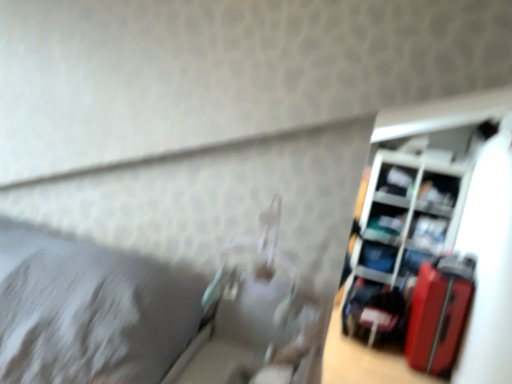
The width and height of the screenshot is (512, 384). Describe the element at coordinates (376, 261) in the screenshot. I see `matte black laptop at right, the 5th shelf in the top-to-bottom sequence` at that location.

Find the location of a particular element. Image resolution: width=512 pixels, height=384 pixels. shiny red suitcase at right is located at coordinates (439, 313).

What do you see at coordinates (438, 194) in the screenshot? I see `matte black shelf at upper right, the fourth shelf when ordered from bottom to top` at bounding box center [438, 194].

This screenshot has width=512, height=384. In order to click on matte plastic shelf at right, the second shelf from the bottom in this screenshot , I will do `click(406, 225)`.

Does point (371, 272) come closer to viewer compared to point (398, 205)?

That is False.

Does matte black laptop at right, the 5th shelf in the top-to-bottom sequence, have a greater width compared to matte plastic shelf at right, arranged as the fourth shelf when viewed from the top?

Incorrect, the width of matte black laptop at right, the 5th shelf in the top-to-bottom sequence, does not surpass that of matte plastic shelf at right, arranged as the fourth shelf when viewed from the top.

Considering the relative positions of matte black laptop at right, the 5th shelf in the top-to-bottom sequence, and matte plastic shelf at right, the second shelf from the bottom, in the image provided, is matte black laptop at right, the 5th shelf in the top-to-bottom sequence, to the right of matte plastic shelf at right, the second shelf from the bottom, from the viewer's perspective?

In fact, matte black laptop at right, the 5th shelf in the top-to-bottom sequence, is to the left of matte plastic shelf at right, the second shelf from the bottom.

From the image's perspective, between matte plastic shelf at right, the second shelf from the bottom, and black plastic shelf at upper right, the 5th shelf ordered from the bottom, which one is located above?

black plastic shelf at upper right, the 5th shelf ordered from the bottom.

How many degrees apart are the facing directions of matte plastic shelf at right, the second shelf from the bottom, and black plastic shelf at upper right, which ranks as the 1th shelf in top-to-bottom order?

5.65 degrees separate the facing orientations of matte plastic shelf at right, the second shelf from the bottom, and black plastic shelf at upper right, which ranks as the 1th shelf in top-to-bottom order.

Does matte plastic shelf at right, the second shelf from the bottom, have a greater height compared to black plastic shelf at upper right, which ranks as the 1th shelf in top-to-bottom order?

Indeed, matte plastic shelf at right, the second shelf from the bottom, has a greater height compared to black plastic shelf at upper right, which ranks as the 1th shelf in top-to-bottom order.

Does matte plastic shelf at right, arranged as the fourth shelf when viewed from the top, come behind black plastic shelf at upper right, which ranks as the 1th shelf in top-to-bottom order?

No, the depth of matte plastic shelf at right, arranged as the fourth shelf when viewed from the top, is less than that of black plastic shelf at upper right, which ranks as the 1th shelf in top-to-bottom order.

From the image's perspective, which object appears higher, black plastic shelf at upper right, the 5th shelf ordered from the bottom, or matte black shelf at upper right, the fourth shelf when ordered from bottom to top?

black plastic shelf at upper right, the 5th shelf ordered from the bottom, appears higher in the image.

Who is taller, black plastic shelf at upper right, the 5th shelf ordered from the bottom, or matte black shelf at upper right, the fourth shelf when ordered from bottom to top?

With more height is matte black shelf at upper right, the fourth shelf when ordered from bottom to top.

At what (x,y) coordinates should I click in order to perform the action: click on the 2nd shelf behind when counting from the matte black shelf at upper right, the second shelf in the top-to-bottom sequence. Please return your answer as a coordinate pair (x, y). Looking at the image, I should click on (396, 186).

Is black plastic shelf at upper right, which ranks as the 1th shelf in top-to-bottom order, not near matte black shelf at upper right, the second shelf in the top-to-bottom sequence?

That's not correct — black plastic shelf at upper right, which ranks as the 1th shelf in top-to-bottom order, is a little close to matte black shelf at upper right, the second shelf in the top-to-bottom sequence.

From the image's perspective, which one is positioned lower, shiny red suitcase at right or matte plastic shelf at right, arranged as the fourth shelf when viewed from the top?

shiny red suitcase at right, from the image's perspective.

The image size is (512, 384). Find the location of `luggage on the left of the matte plastic shelf at right, the second shelf from the bottom`. luggage on the left of the matte plastic shelf at right, the second shelf from the bottom is located at coordinates (439, 313).

Between shiny red suitcase at right and matte plastic shelf at right, arranged as the fourth shelf when viewed from the top, which one has more height?

With more height is matte plastic shelf at right, arranged as the fourth shelf when viewed from the top.

Is shiny red suitcase at right to the right of matte plastic shelf at right, the second shelf from the bottom, from the viewer's perspective?

No, shiny red suitcase at right is not to the right of matte plastic shelf at right, the second shelf from the bottom.

From the picture: Is matte black shelf at upper right, the second shelf in the top-to-bottom sequence, located outside matte plastic shelf at upper right, placed as the 3th shelf when sorted from top to bottom?

Absolutely, matte black shelf at upper right, the second shelf in the top-to-bottom sequence, is external to matte plastic shelf at upper right, placed as the 3th shelf when sorted from top to bottom.

Is point (434, 180) closer or farther from the camera than point (441, 237)?

Clearly, point (434, 180) is more distant from the camera than point (441, 237).

From the image's perspective, is matte black shelf at upper right, the fourth shelf when ordered from bottom to top, located beneath matte plastic shelf at upper right, placed as the 3th shelf when sorted from top to bottom?

No, from the image's perspective, matte black shelf at upper right, the fourth shelf when ordered from bottom to top, is not beneath matte plastic shelf at upper right, placed as the 3th shelf when sorted from top to bottom.

What's the angular difference between shiny red suitcase at right and matte black shelf at upper right, the second shelf in the top-to-bottom sequence,'s facing directions?

The facing directions of shiny red suitcase at right and matte black shelf at upper right, the second shelf in the top-to-bottom sequence, are 82.2 degrees apart.

Is shiny red suitcase at right not near matte black shelf at upper right, the fourth shelf when ordered from bottom to top?

Yes, shiny red suitcase at right and matte black shelf at upper right, the fourth shelf when ordered from bottom to top, are located far from each other.

Which is closer to the camera, [467,261] or [426,180]?

Point [467,261] appears to be closer to the viewer than point [426,180].

Does shiny red suitcase at right have a greater width compared to matte black shelf at upper right, the second shelf in the top-to-bottom sequence?

Indeed, shiny red suitcase at right has a greater width compared to matte black shelf at upper right, the second shelf in the top-to-bottom sequence.

From the image's perspective, is matte plastic shelf at right, arranged as the fourth shelf when viewed from the top, positioned above or below matte black shelf at upper right, the second shelf in the top-to-bottom sequence?

matte plastic shelf at right, arranged as the fourth shelf when viewed from the top, is situated lower than matte black shelf at upper right, the second shelf in the top-to-bottom sequence, in the image.

Which object is wider, matte plastic shelf at right, the second shelf from the bottom, or matte black shelf at upper right, the second shelf in the top-to-bottom sequence?

matte plastic shelf at right, the second shelf from the bottom.

Is matte plastic shelf at right, arranged as the fourth shelf when viewed from the top, turned away from matte black shelf at upper right, the second shelf in the top-to-bottom sequence?

Yes, matte plastic shelf at right, arranged as the fourth shelf when viewed from the top, is positioned with its back facing matte black shelf at upper right, the second shelf in the top-to-bottom sequence.

Does matte plastic shelf at right, arranged as the fourth shelf when viewed from the top, appear on the right side of matte black shelf at upper right, the second shelf in the top-to-bottom sequence?

Incorrect, matte plastic shelf at right, arranged as the fourth shelf when viewed from the top, is not on the right side of matte black shelf at upper right, the second shelf in the top-to-bottom sequence.

At what (x,y) coordinates should I click in order to perform the action: click on shelf that is the 4th object located in front of the matte black laptop at right, which is the 1th shelf in bottom-to-top order. Please return your answer as a coordinate pair (x, y). The height and width of the screenshot is (384, 512). Looking at the image, I should click on (406, 225).

From the image's perspective, starting from the black plastic shelf at upper right, which ranks as the 1th shelf in top-to-bottom order, which shelf is the 3rd one below? Please provide its 2D coordinates.

[(406, 225)]

Based on their spatial positions, is matte black shelf at upper right, the second shelf in the top-to-bottom sequence, or shiny red suitcase at right closer to black plastic shelf at upper right, the 5th shelf ordered from the bottom?

matte black shelf at upper right, the second shelf in the top-to-bottom sequence, lies closer to black plastic shelf at upper right, the 5th shelf ordered from the bottom, than the other object.

Considering their positions, is black plastic shelf at upper right, the 5th shelf ordered from the bottom, positioned further to shiny red suitcase at right than matte plastic shelf at right, arranged as the fourth shelf when viewed from the top?

Based on the image, black plastic shelf at upper right, the 5th shelf ordered from the bottom, appears to be further to shiny red suitcase at right.

When comparing their distances from matte plastic shelf at upper right, placed as the 3th shelf when sorted from top to bottom, does matte black shelf at upper right, the second shelf in the top-to-bottom sequence, or black plastic shelf at upper right, which ranks as the 1th shelf in top-to-bottom order, seem further?

Among the two, black plastic shelf at upper right, which ranks as the 1th shelf in top-to-bottom order, is located further to matte plastic shelf at upper right, placed as the 3th shelf when sorted from top to bottom.

From the image, which object appears to be nearer to matte black shelf at upper right, the second shelf in the top-to-bottom sequence, shiny red suitcase at right or matte plastic shelf at right, the second shelf from the bottom?

matte plastic shelf at right, the second shelf from the bottom, is positioned closer to the anchor matte black shelf at upper right, the second shelf in the top-to-bottom sequence.

Which object lies nearer to the anchor point matte plastic shelf at upper right, the third shelf from the bottom, matte black shelf at upper right, the second shelf in the top-to-bottom sequence, or matte black laptop at right, which is the 1th shelf in bottom-to-top order?

matte black shelf at upper right, the second shelf in the top-to-bottom sequence, is closer to matte plastic shelf at upper right, the third shelf from the bottom.

Considering their positions, is shiny red suitcase at right positioned further to matte black shelf at upper right, the fourth shelf when ordered from bottom to top, than matte plastic shelf at upper right, placed as the 3th shelf when sorted from top to bottom?

shiny red suitcase at right.

From the image, which object appears to be nearer to matte black shelf at upper right, the fourth shelf when ordered from bottom to top, matte plastic shelf at right, arranged as the fourth shelf when viewed from the top, or matte plastic shelf at upper right, the third shelf from the bottom?

The object closer to matte black shelf at upper right, the fourth shelf when ordered from bottom to top, is matte plastic shelf at upper right, the third shelf from the bottom.

From the image, which object appears to be nearer to matte black shelf at upper right, the fourth shelf when ordered from bottom to top, matte black laptop at right, the 5th shelf in the top-to-bottom sequence, or matte plastic shelf at upper right, the third shelf from the bottom?

matte plastic shelf at upper right, the third shelf from the bottom, lies closer to matte black shelf at upper right, the fourth shelf when ordered from bottom to top, than the other object.

The image size is (512, 384). Find the location of `shelf between matte black shelf at upper right, the second shelf in the top-to-bottom sequence, and matte plastic shelf at right, the second shelf from the bottom, from top to bottom`. shelf between matte black shelf at upper right, the second shelf in the top-to-bottom sequence, and matte plastic shelf at right, the second shelf from the bottom, from top to bottom is located at coordinates (429, 233).

Where is `shelf between black plastic shelf at upper right, which ranks as the 1th shelf in top-to-bottom order, and matte plastic shelf at upper right, placed as the 3th shelf when sorted from top to bottom, vertically`? This screenshot has width=512, height=384. shelf between black plastic shelf at upper right, which ranks as the 1th shelf in top-to-bottom order, and matte plastic shelf at upper right, placed as the 3th shelf when sorted from top to bottom, vertically is located at coordinates (438, 194).